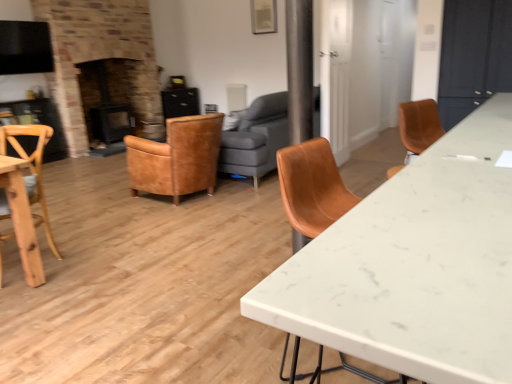
Locate an element on the screen. vacant area that lies between natural wood chair at left, which ranks as the first chair in front-to-back order, and white marble desk at center is located at coordinates (134, 300).